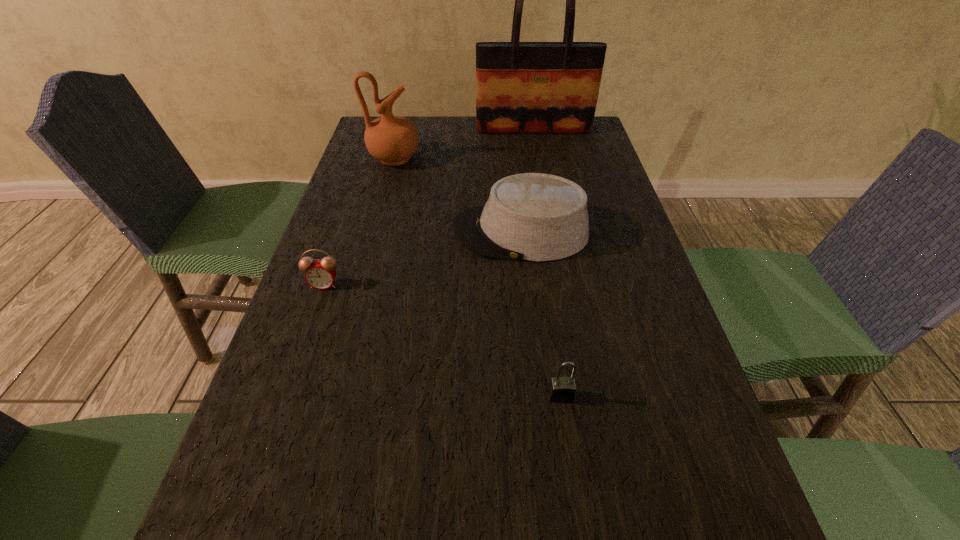
This screenshot has height=540, width=960. I want to click on the farthest object, so click(x=521, y=87).

The width and height of the screenshot is (960, 540). What are the coordinates of `the tallest object` in the screenshot? It's located at (521, 87).

You are a GUI agent. You are given a task and a screenshot of the screen. Output one action in this format:
    pyautogui.click(x=<x>, y=<y>)
    Task: Click on the second tallest object
    
    Given the screenshot: What is the action you would take?
    pyautogui.click(x=391, y=139)

At what (x,y) coordinates should I click in order to perform the action: click on the second farthest object. Please return your answer as a coordinate pair (x, y). Image resolution: width=960 pixels, height=540 pixels. Looking at the image, I should click on (391, 139).

Locate an element on the screen. hat is located at coordinates (537, 217).

Identify the location of the nearest object. This screenshot has height=540, width=960. (561, 389).

You are a GUI agent. You are given a task and a screenshot of the screen. Output one action in this format:
    pyautogui.click(x=<x>, y=<y>)
    Task: Click on the fourth farthest object
    The height and width of the screenshot is (540, 960).
    Given the screenshot: What is the action you would take?
    pyautogui.click(x=320, y=274)

This screenshot has width=960, height=540. Identify the location of vacant area located on the front-facing side of the shopping bag. (545, 194).

This screenshot has width=960, height=540. I want to click on free space located 0.130m on the spout of the second tallest object, so click(463, 159).

This screenshot has width=960, height=540. I want to click on vacant space situated 0.320m on the front-facing side of the third farthest object, so click(324, 232).